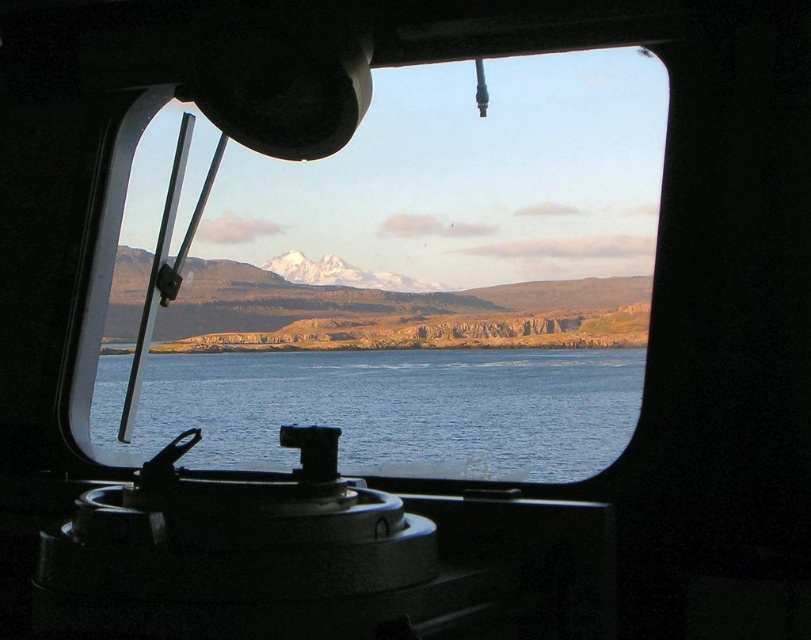
From the picture: You are a passenger on a boat and want to know if you can fit a 40 cm wide box between the blue water at center and the snowy rock mountain at center through the window. Can you fit it?

The distance between blue water at center and snowy rock mountain at center is 53.51 centimeters, so the 40 cm wide box can fit since it is narrower than the available space.

You are inside a boat and want to know which point is closer to the front of the boat. Looking through the window, you see two points marked on the window at coordinates point (589, 451) and point (315, 369). Based on their positions, which point is closer to the front of the boat?

Point (589, 451) is in front of point (315, 369), so it is closer to the front of the boat.